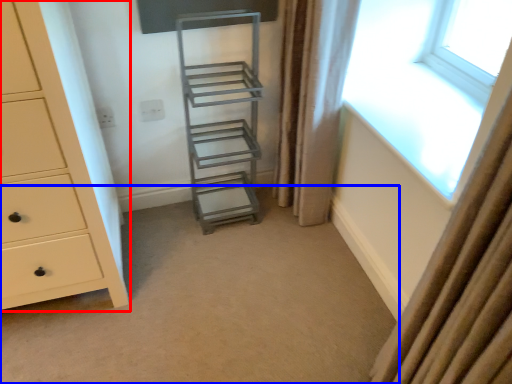
Question: Among these objects, which one is nearest to the camera, chest of drawers (highlighted by a red box) or plain (highlighted by a blue box)?

Choices:
 (A) chest of drawers
 (B) plain

Answer: (A)